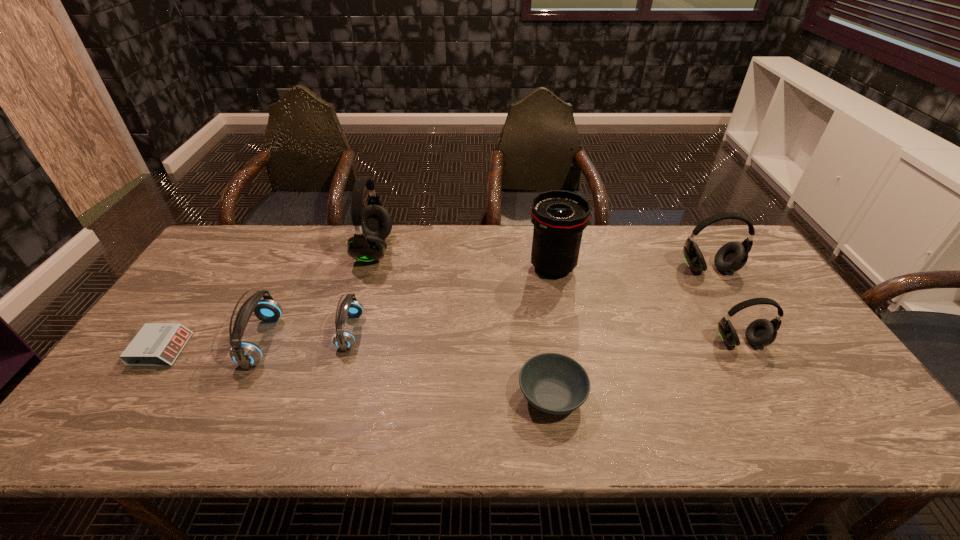
This screenshot has width=960, height=540. Find the location of `gray soup bowl`. gray soup bowl is located at coordinates (553, 383).

Where is `alarm clock`? alarm clock is located at coordinates (157, 344).

I want to click on the shortest object, so click(157, 344).

Where is `free space located 0.130m on the ear cups of the leftmost black headset`? free space located 0.130m on the ear cups of the leftmost black headset is located at coordinates (431, 250).

I want to click on free location located 0.140m on the left of the telephoto lens, so click(x=482, y=267).

Locate an element on the screen. vacant space located on the ear cups of the fourth shortest headset is located at coordinates (724, 295).

This screenshot has height=540, width=960. What are the coordinates of `free spot located on the ear cups of the nearest black headset` in the screenshot? It's located at (774, 400).

This screenshot has height=540, width=960. What are the coordinates of `free space located 0.220m on the ear cups of the leftmost headset` in the screenshot? It's located at (359, 341).

Find the location of a particular element. This screenshot has height=540, width=960. free space located on the ear cups of the shortest headset is located at coordinates (442, 332).

The image size is (960, 540). Find the location of `vacant space situated on the back of the gray soup bowl`. vacant space situated on the back of the gray soup bowl is located at coordinates (540, 311).